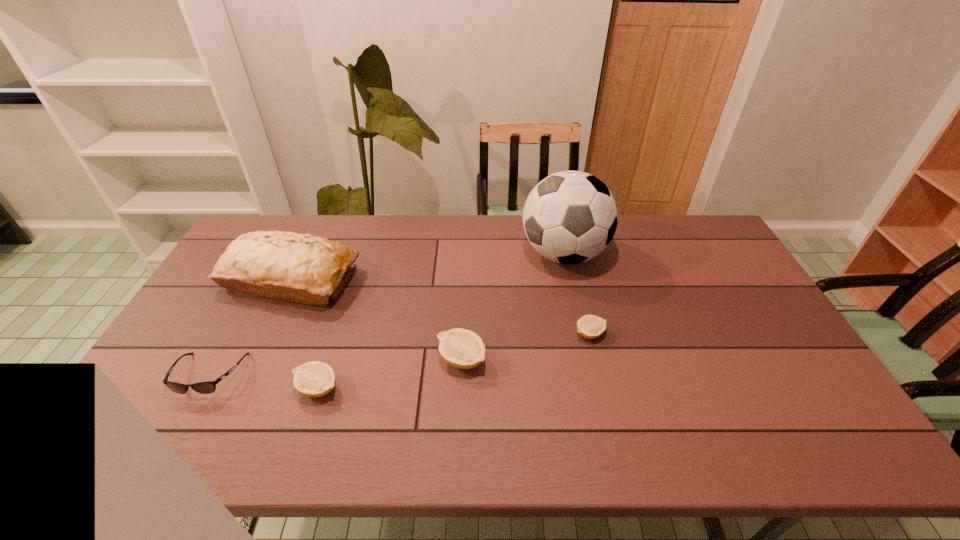
Please point a spot on the right to add another lemon. Please provide its 2D coordinates. Your answer should be formatted as a tuple, i.e. [(x, y)], where the tuple contains the x and y coordinates of a point satisfying the conditions above.

[(706, 311)]